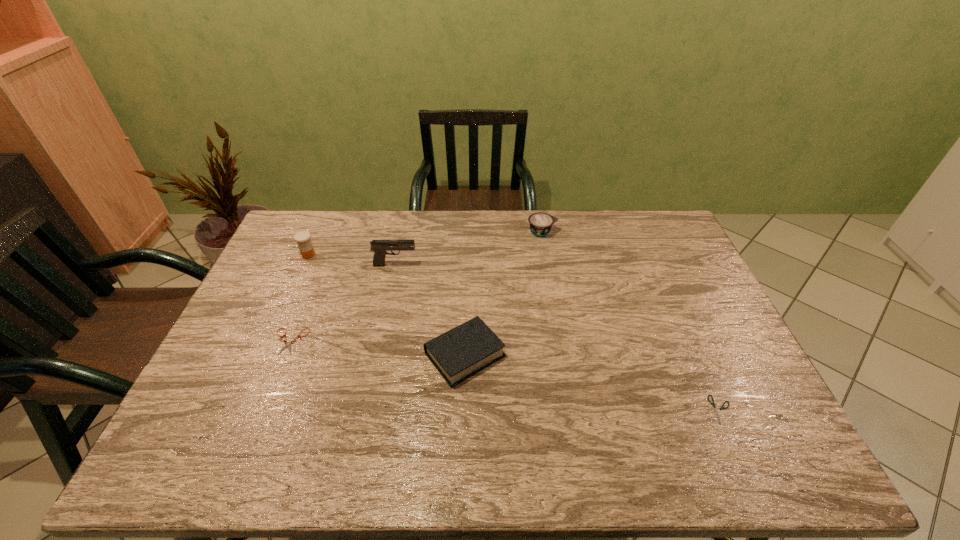
This screenshot has height=540, width=960. Identify the location of the third object from left to right. (379, 247).

At what (x,y) coordinates should I click in order to perform the action: click on the tallest object. Please return your answer as a coordinate pair (x, y). Image resolution: width=960 pixels, height=540 pixels. Looking at the image, I should click on (379, 247).

Locate an element on the screen. The width and height of the screenshot is (960, 540). medicine is located at coordinates (302, 238).

The image size is (960, 540). Identify the location of the second farthest object. (302, 238).

The width and height of the screenshot is (960, 540). I want to click on the farthest object, so click(x=540, y=223).

At what (x,y) coordinates should I click in order to perform the action: click on the second object from right to left. Please return your answer as a coordinate pair (x, y). The image size is (960, 540). Looking at the image, I should click on (540, 223).

This screenshot has width=960, height=540. What are the coordinates of `Bible` in the screenshot? It's located at (459, 353).

This screenshot has height=540, width=960. I want to click on the farther shears, so click(287, 344).

Identify the location of the fifth tallest object. (287, 344).

Locate an element on the screen. The width and height of the screenshot is (960, 540). the shortest object is located at coordinates (716, 413).